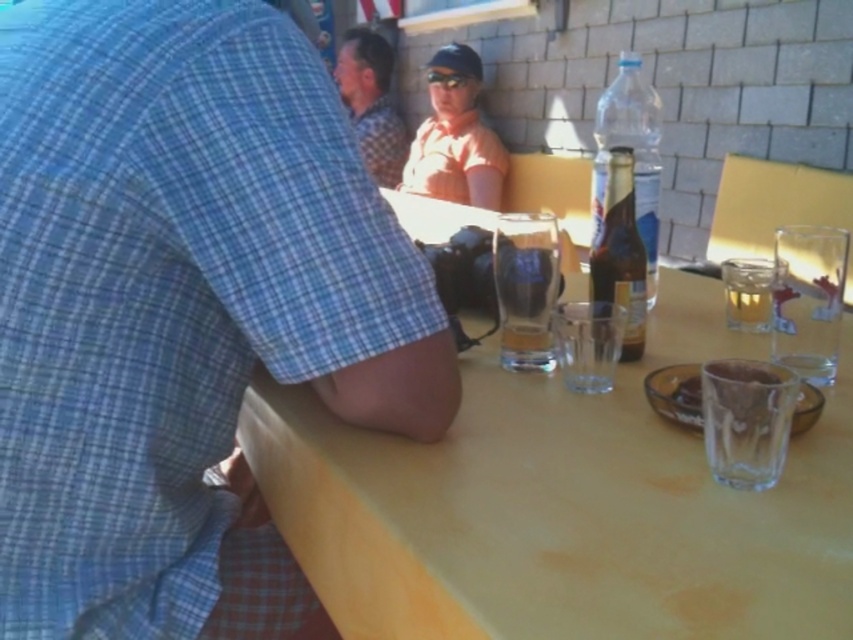
You are a photographer trying to capture a closeup of the clear plastic bottle at upper right without including the checkered fabric shirt at upper center in the frame. Is this possible given their positions?

The clear plastic bottle at upper right is in front of the checkered fabric shirt at upper center, so it is possible to capture a closeup of the clear plastic bottle at upper right without including the checkered fabric shirt at upper center in the frame by focusing on the bottle and adjusting the camera angle to exclude the shirt.

You are at a table with several items. You need to grab the clear plastic bottle at upper right to drink from it. Which direction should you reach relative to the checkered fabric shirt at upper center?

The clear plastic bottle at upper right is to the right of the checkered fabric shirt at upper center, so you should reach to the right of the checkered fabric shirt at upper center to grab it.